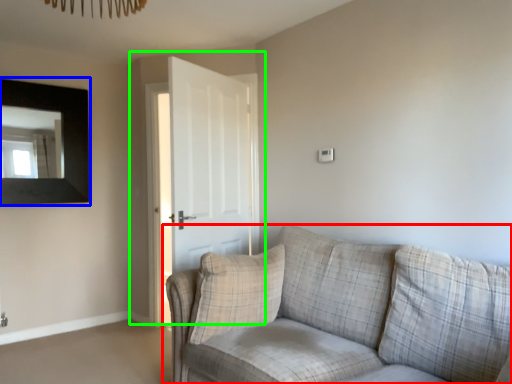
Question: Which object is the closest to the studio couch (highlighted by a red box)? Choose among these: picture frame (highlighted by a blue box) or door (highlighted by a green box).

Choices:
 (A) picture frame
 (B) door

Answer: (B)